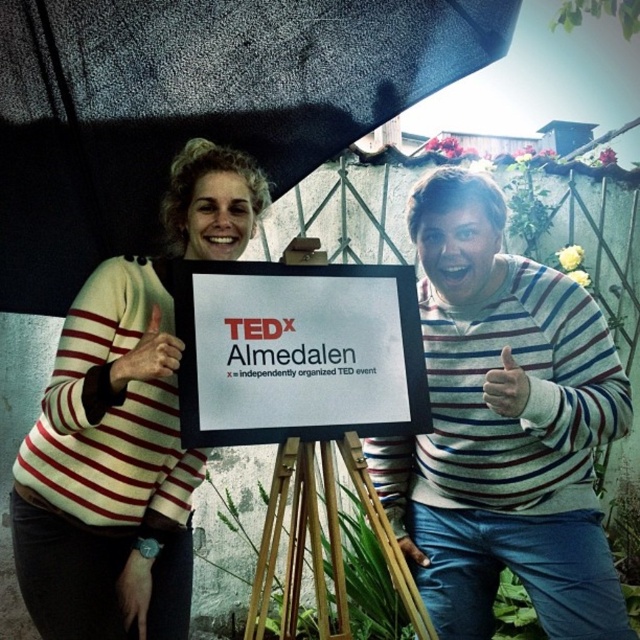
Question: Is black matte umbrella at upper center behind white paper sign at center?

Choices:
 (A) yes
 (B) no

Answer: (A)

Question: Among these points, which one is nearest to the camera?

Choices:
 (A) (96, 308)
 (B) (294, 636)
 (C) (221, 3)
 (D) (387, 394)

Answer: (A)

Question: Considering the relative positions of striped sweater at left and wooden tripod at center in the image provided, where is striped sweater at left located with respect to wooden tripod at center?

Choices:
 (A) left
 (B) right

Answer: (A)

Question: Does striped sweater at center lie in front of striped sweater at left?

Choices:
 (A) yes
 (B) no

Answer: (B)

Question: Which object is positioned closest to the striped sweater at left?

Choices:
 (A) striped sweater at center
 (B) black matte umbrella at upper center
 (C) wooden tripod at center
 (D) white paper sign at center

Answer: (D)

Question: Among these points, which one is farthest from the camera?

Choices:
 (A) (173, 99)
 (B) (301, 550)
 (C) (173, 600)
 (D) (449, 481)

Answer: (A)